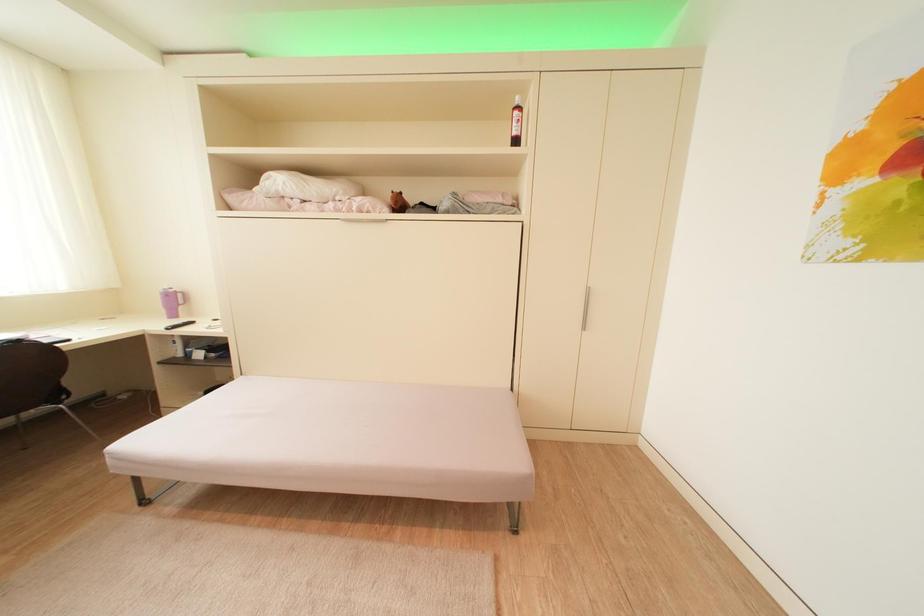
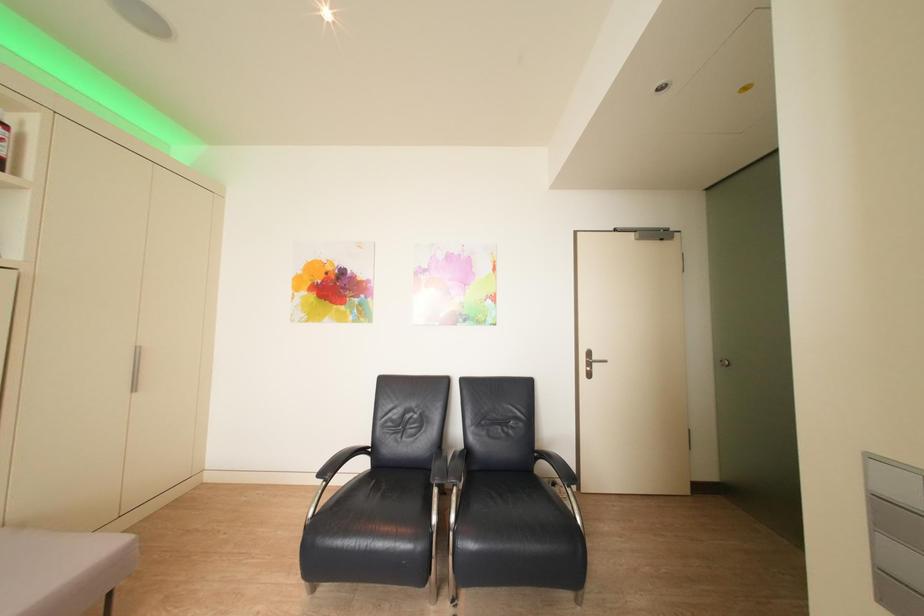
Question: The camera is either moving clockwise (left) or counter-clockwise (right) around the object. The first image is from the beginning of the video and the second image is from the end. Is the camera moving left or right when shooting the video?

Choices:
 (A) Left
 (B) Right

Answer: (A)